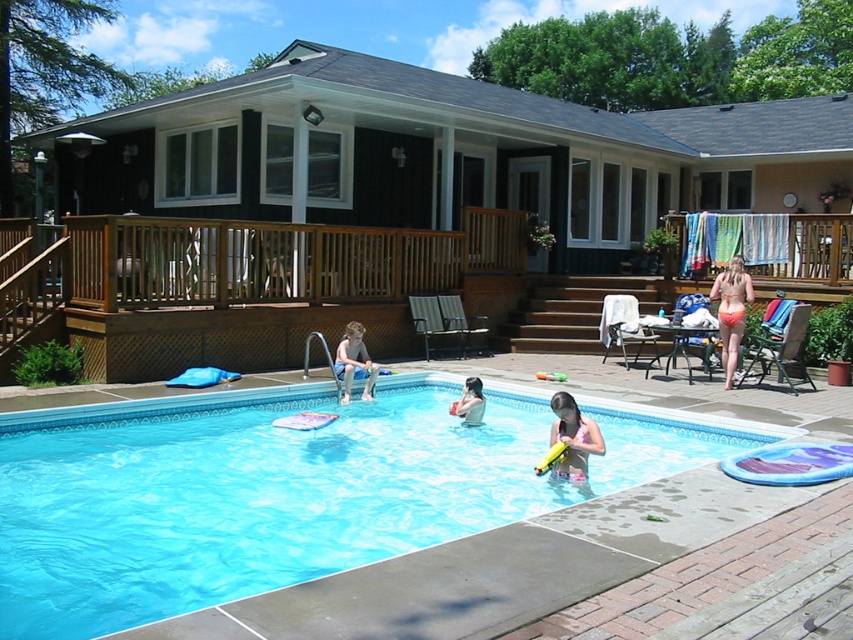
You are planning to place a 1.5 meter tall garden statue on the wooden deck at center. Considering the orange bikini at right is currently occupying space there, will the statue fit in terms of height?

The wooden deck at center is shorter than orange bikini at right. Since the statue is 1.5 meters tall, and the deck is shorter than the bikini, which is presumably taller than 1.5 meters, the statue should fit in terms of height.

You are standing on the wooden deck at center and want to jump into the pool. Which direction should you move to reach the blue tile swimming pool at center?

The blue tile swimming pool at center is below the wooden deck at center, so you should move downward to reach it.